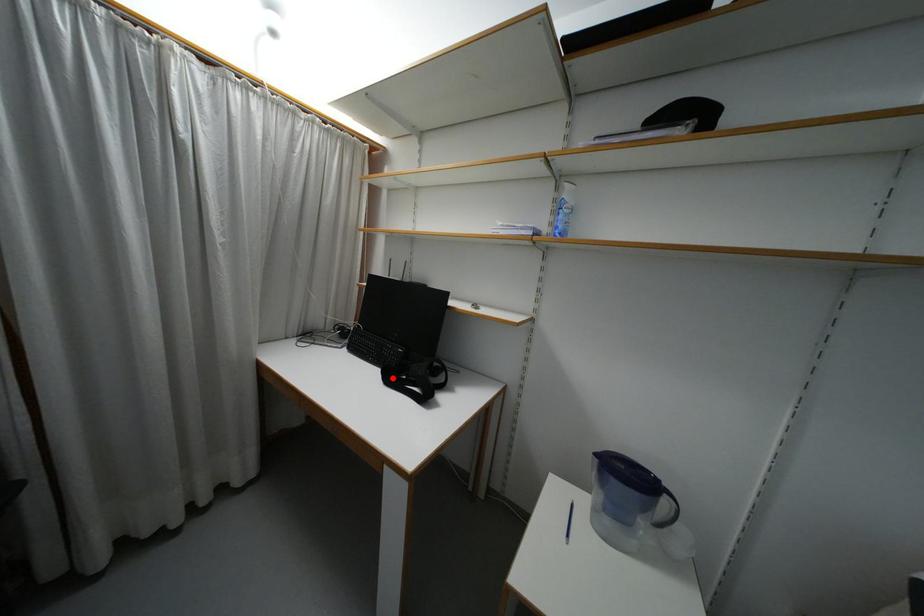
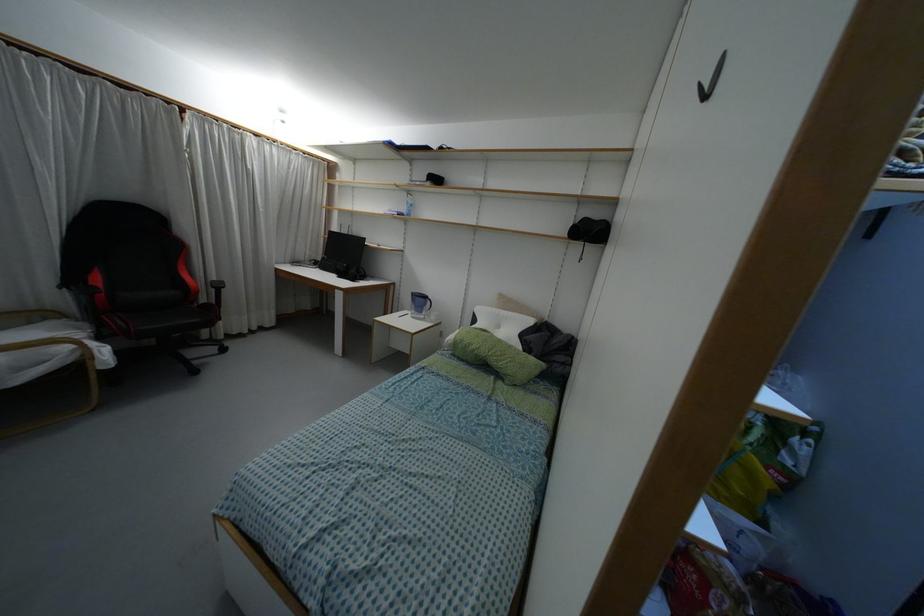
Find the pixel in the second image that matches the highlighted location in the first image.

(341, 275)